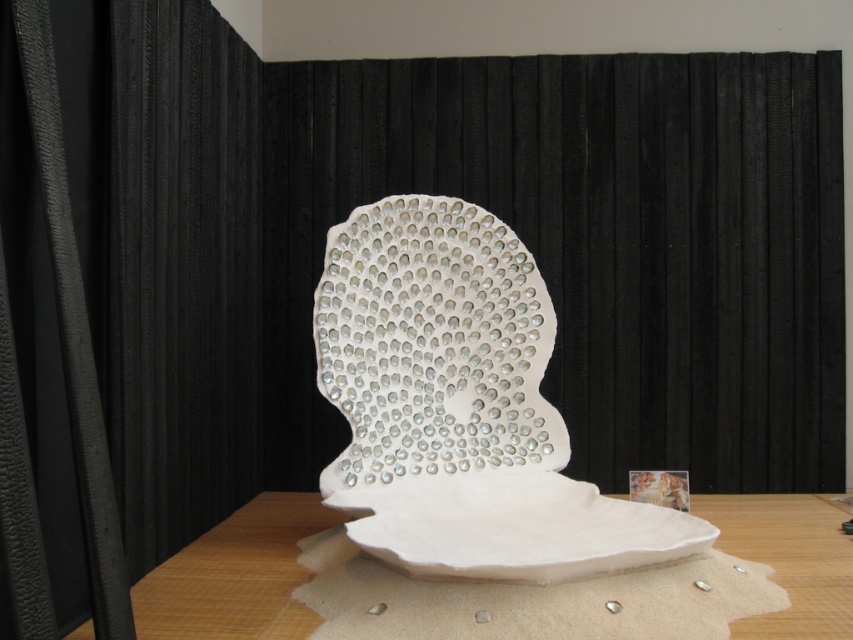
Question: In this image, where is white glossy shell at center located relative to white matte table at center?

Choices:
 (A) left
 (B) right

Answer: (A)

Question: Which point is closer to the camera taking this photo?

Choices:
 (A) (675, 502)
 (B) (515, 426)
 (C) (166, 600)

Answer: (C)

Question: Does white matte table at center have a greater width compared to matte white painting at center?

Choices:
 (A) no
 (B) yes

Answer: (B)

Question: Estimate the real-world distances between objects in this image. Which object is closer to the matte white painting at center?

Choices:
 (A) white glossy shell at center
 (B) white matte table at center

Answer: (B)

Question: Is white glossy shell at center thinner than white matte table at center?

Choices:
 (A) yes
 (B) no

Answer: (B)

Question: Which of these objects is positioned farthest from the white matte table at center?

Choices:
 (A) white glossy shell at center
 (B) matte white painting at center

Answer: (A)